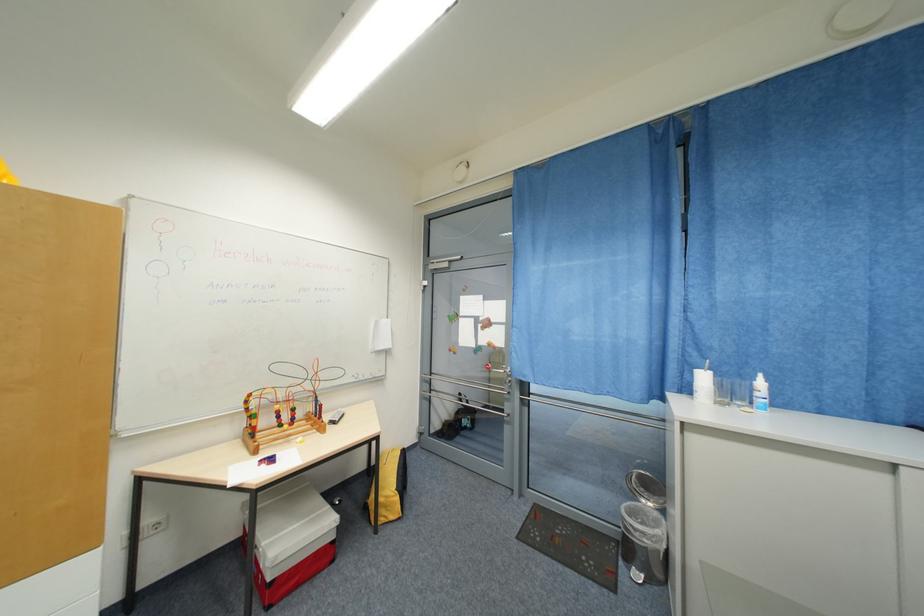
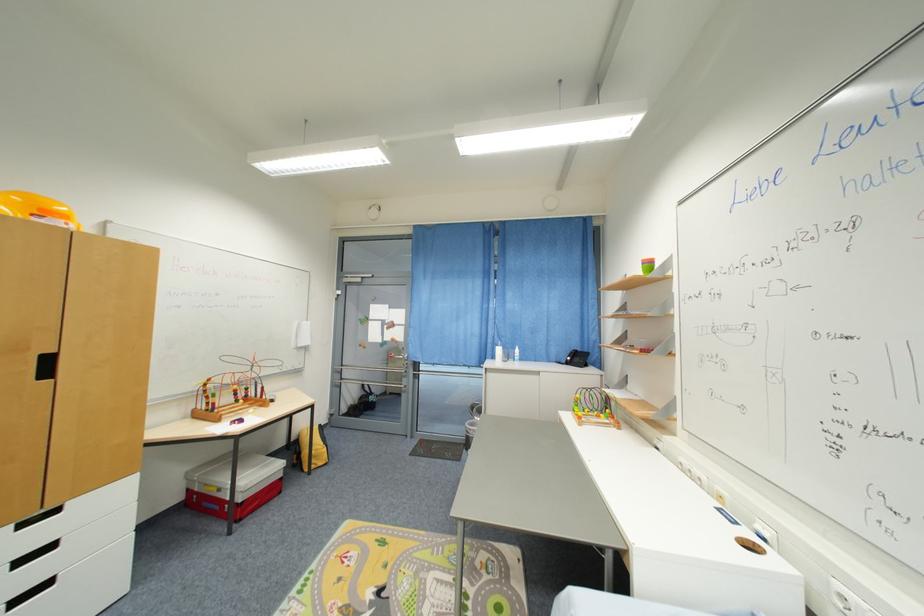
Question: In a continuous first-person perspective shot, in which direction is the camera moving?

Choices:
 (A) Left
 (B) Right
 (C) Forward
 (D) Backward

Answer: (D)